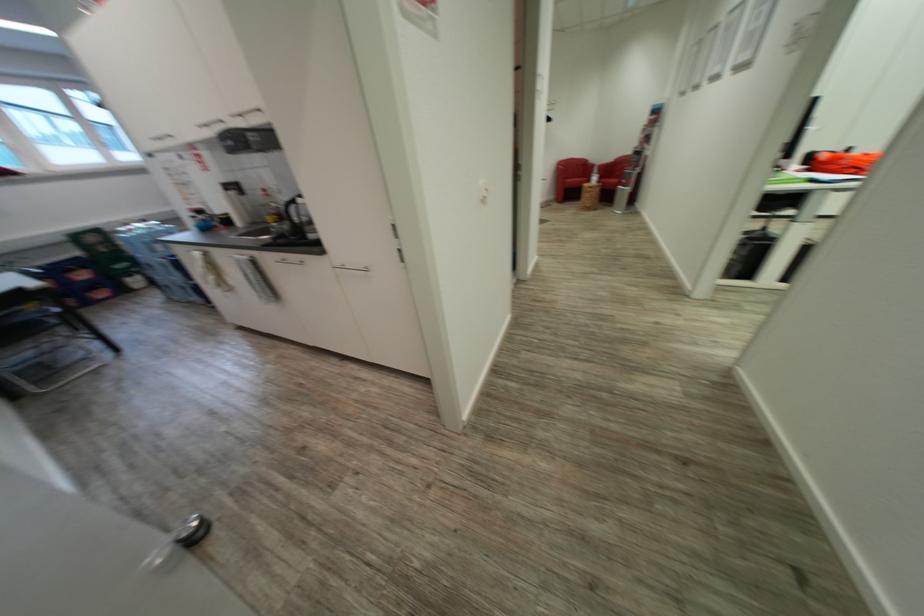
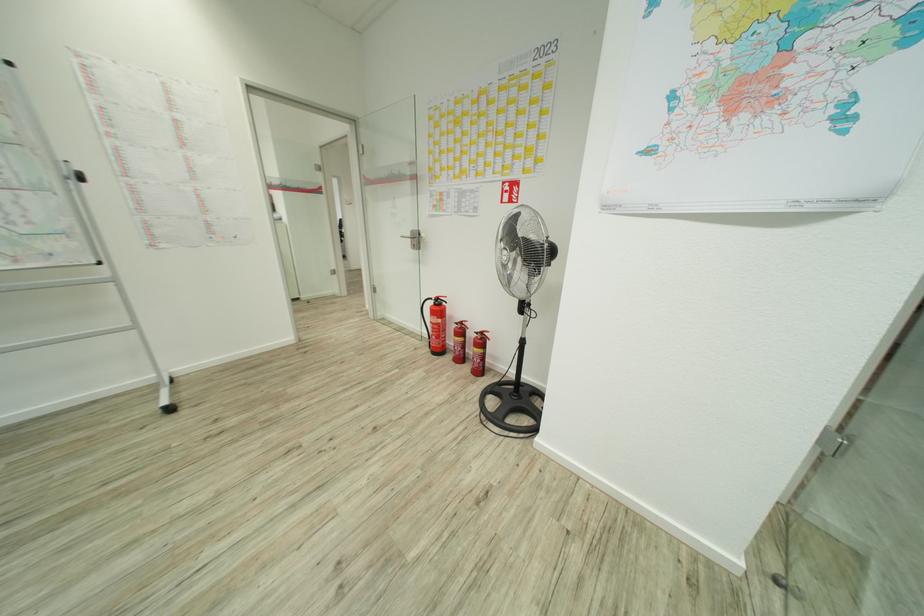
Question: I am providing you with two images of the same scene from different viewpoints. Which of the following objects are not visible in image2?

Choices:
 (A) black wallet
 (B) chrome door stop
 (C) whiteboard locking knob
 (D) whiteboard stand wheel

Answer: (B)